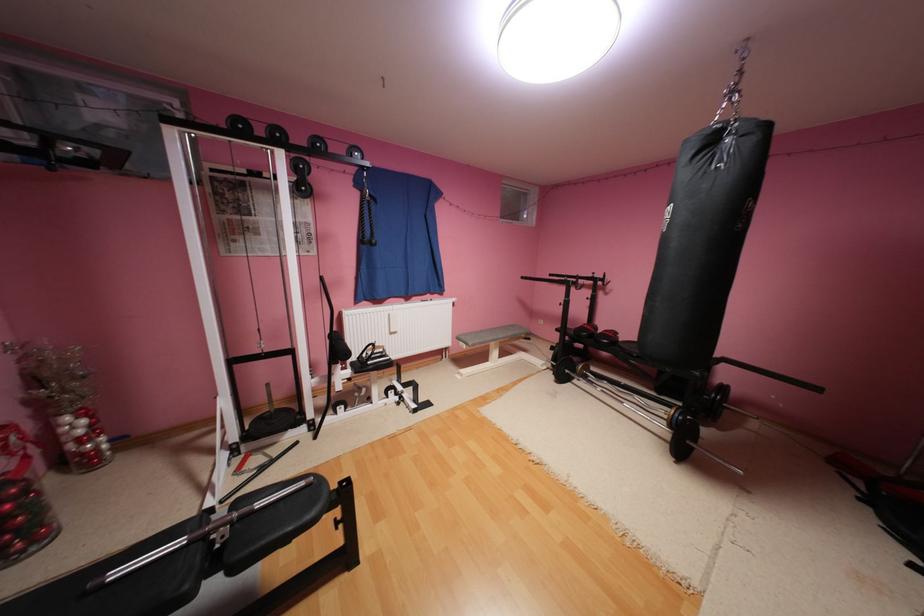
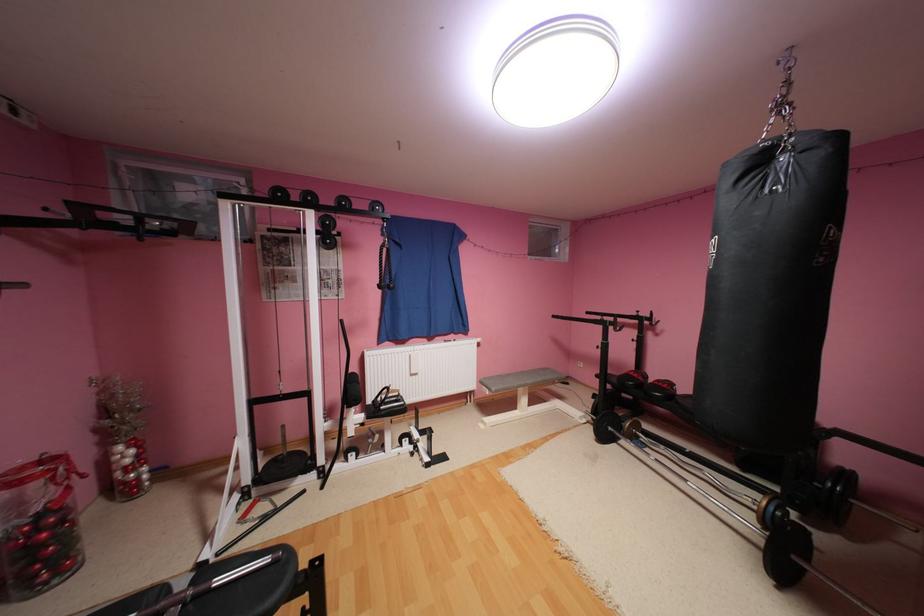
Which direction would the cameraman need to move to produce the second image?

The cameraman walked toward right, forward.